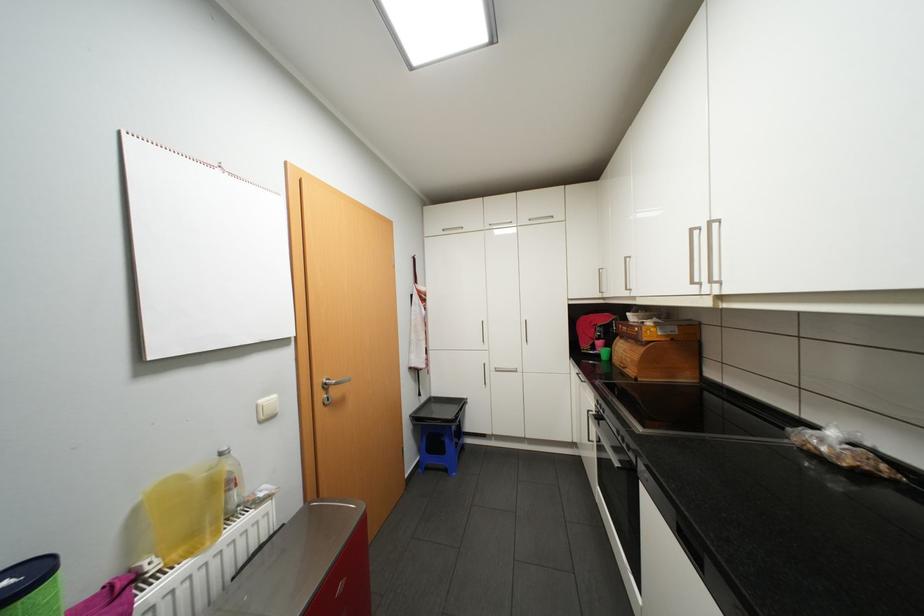
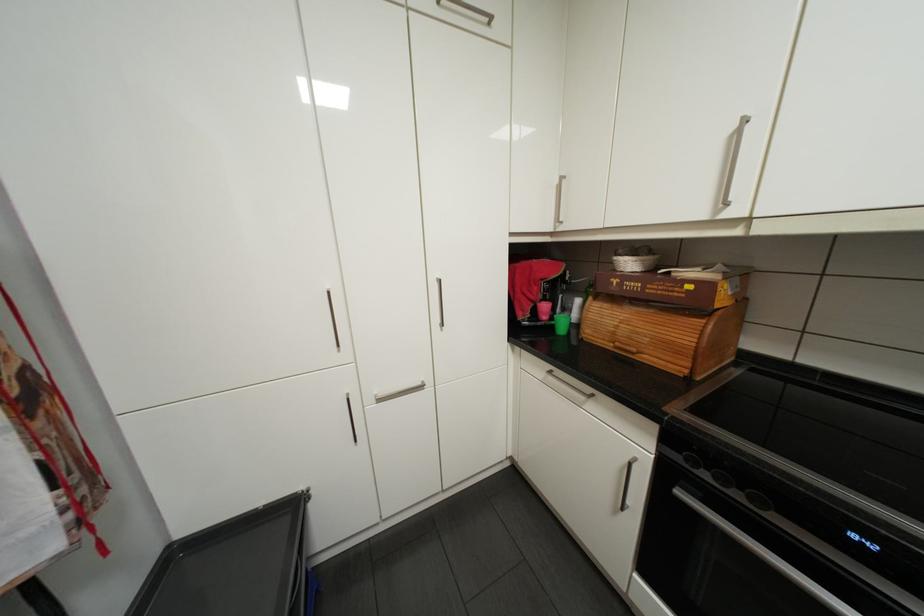
Locate, in the second image, the point that corresponds to pixel 629 337 in the first image.

(602, 297)